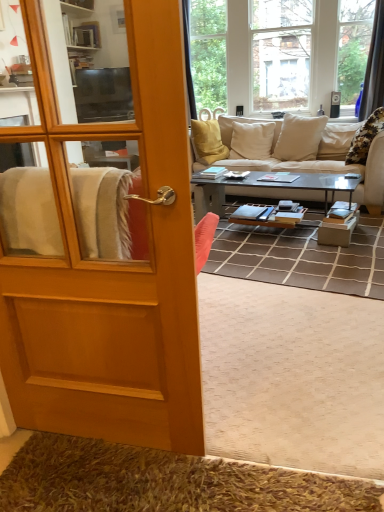
Question: Should I look upward or downward to see metallic gray coffee table at center?

Choices:
 (A) down
 (B) up

Answer: (B)

Question: From the image's perspective, is metallic gray coffee table at center on top of wooden door at left?

Choices:
 (A) yes
 (B) no

Answer: (A)

Question: Is metallic gray coffee table at center oriented away from wooden door at left?

Choices:
 (A) yes
 (B) no

Answer: (A)

Question: Can you confirm if metallic gray coffee table at center is bigger than wooden door at left?

Choices:
 (A) yes
 (B) no

Answer: (A)

Question: Considering the relative sizes of metallic gray coffee table at center and wooden door at left in the image provided, is metallic gray coffee table at center thinner than wooden door at left?

Choices:
 (A) no
 (B) yes

Answer: (A)

Question: Considering the relative positions of metallic gray coffee table at center and wooden door at left in the image provided, is metallic gray coffee table at center to the right of wooden door at left from the viewer's perspective?

Choices:
 (A) yes
 (B) no

Answer: (A)

Question: Is the depth of metallic gray coffee table at center greater than that of wooden door at left?

Choices:
 (A) yes
 (B) no

Answer: (A)

Question: Considering the relative sizes of wooden door at left and brown shaggy rug at lower left in the image provided, is wooden door at left bigger than brown shaggy rug at lower left?

Choices:
 (A) yes
 (B) no

Answer: (A)

Question: Is wooden door at left oriented towards brown shaggy rug at lower left?

Choices:
 (A) no
 (B) yes

Answer: (A)

Question: Are wooden door at left and brown shaggy rug at lower left located far from each other?

Choices:
 (A) yes
 (B) no

Answer: (B)

Question: Is wooden door at left at the right side of brown shaggy rug at lower left?

Choices:
 (A) no
 (B) yes

Answer: (A)

Question: Considering the relative positions of wooden door at left and brown shaggy rug at lower left in the image provided, is wooden door at left to the left of brown shaggy rug at lower left from the viewer's perspective?

Choices:
 (A) no
 (B) yes

Answer: (B)

Question: From a real-world perspective, is wooden door at left positioned over brown shaggy rug at lower left based on gravity?

Choices:
 (A) no
 (B) yes

Answer: (B)

Question: Is metallic gray coffee table at center behind brown shaggy rug at lower left?

Choices:
 (A) yes
 (B) no

Answer: (A)